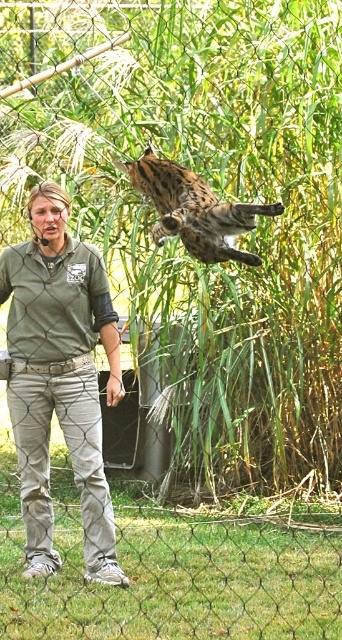
Based on the photo, please provide the 2D coordinates of the gray cotton shirt at center in the image. The answer should be in the format of coordinates in parentheses, like this example format. Please do not add any extra text or explanation. The coordinates should be in the range of 0 to 1, representing the position on the image. The first number is the x coordinate, the second is the y coordinate. The origin point is at the bottom left corner of the image. The x increases to the right, and y increases upward. The gray coton

The coordinates are provided in the Objects Description. The gray cotton shirt at center is located at point (59,378). So the answer is the coordinates in parentheses as specified.

You are a zookeeper standing in front of the gray cotton shirt at center and the spotted fur cheetah at upper center. Which object is closer to you?

The gray cotton shirt at center is closer to you because it is further to the viewer than the spotted fur cheetah at upper center.

You are a zookeeper trying to determine if a new feeding tray can fit between the gray cotton shirt at center and the spotted fur cheetah at upper center. The feeding tray requires 1.2 meters of space. Can the tray fit?

The gray cotton shirt at center is wider than the spotted fur cheetah at upper center, but the description does not provide specific measurements for their widths. Therefore, it is impossible to determine if the feeding tray requiring 1.2 meters of space can fit between them.